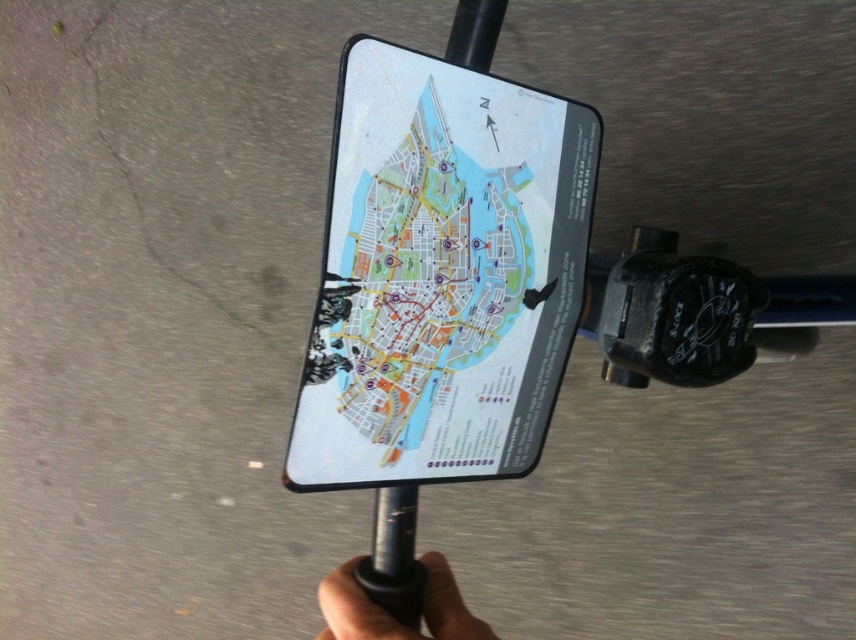
Does white matte map at center appear on the right side of black matte phone at center?

Indeed, white matte map at center is positioned on the right side of black matte phone at center.

Who is positioned more to the left, white matte map at center or black matte phone at center?

black matte phone at center is more to the left.

Find the location of `white matte map at center`. white matte map at center is located at coordinates (441, 275).

Locate an element on the screen. This screenshot has width=856, height=640. white matte map at center is located at coordinates (441, 275).

Consider the image. Who is lower down, white matte map at center or black matte grip at lower center?

black matte grip at lower center

Between white matte map at center and black matte grip at lower center, which one has less height?

Standing shorter between the two is black matte grip at lower center.

At what (x,y) coordinates should I click in order to perform the action: click on white matte map at center. Please return your answer as a coordinate pair (x, y). Looking at the image, I should click on (441, 275).

Identify the location of black matte phone at center. This screenshot has width=856, height=640. pyautogui.click(x=394, y=556).

Does point (360, 577) come behind point (343, 628)?

Yes, point (360, 577) is farther from viewer.

Identify the location of black matte phone at center. (394, 556).